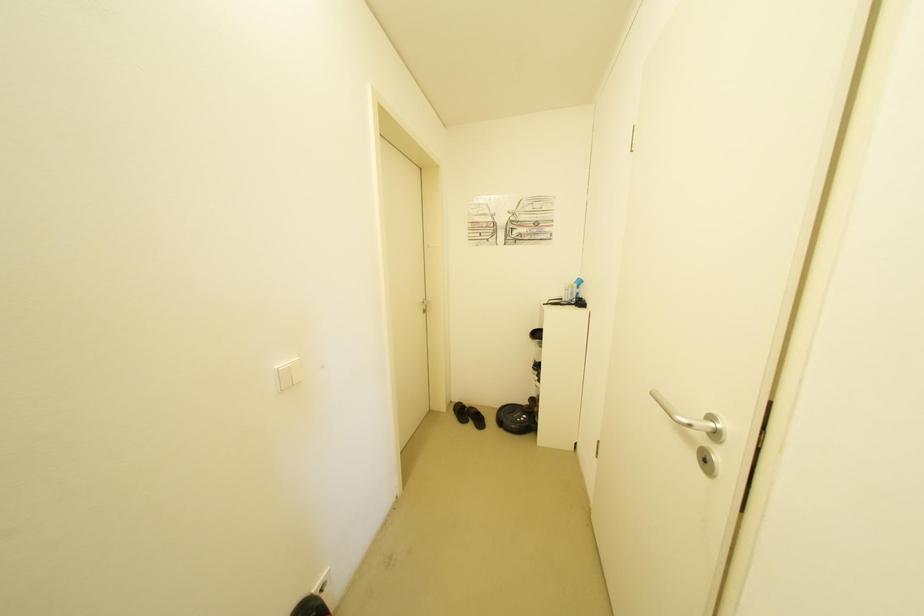
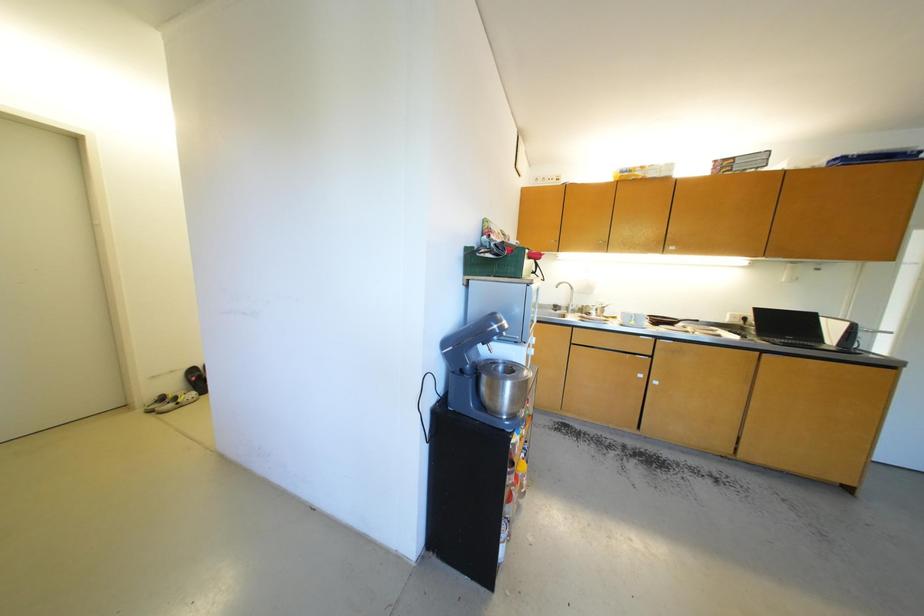
Based on the photo, in a continuous first-person perspective shot, in which direction is the camera moving?

The cameraman moved toward right, backward.